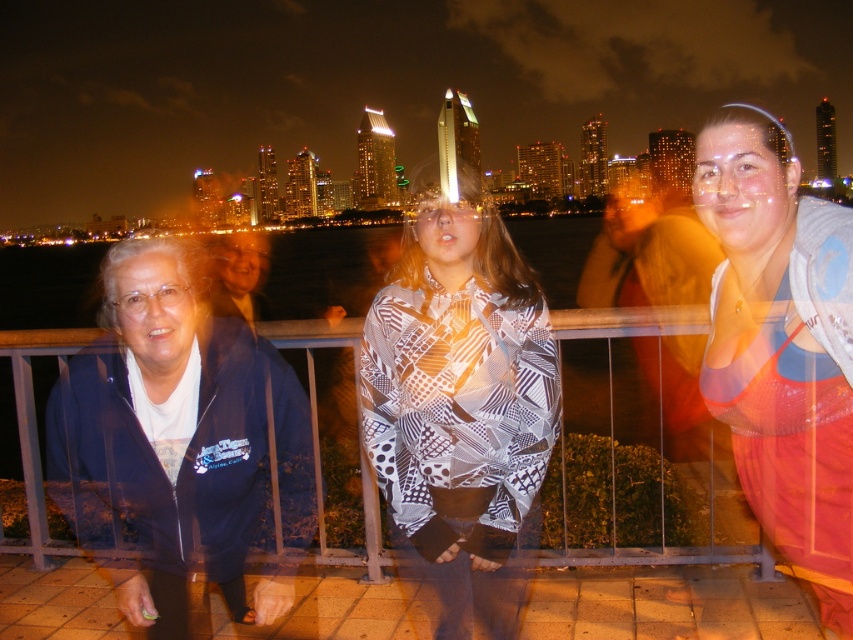
Does blue zip-up jacket at left have a lesser height compared to matte gray tank top at right?

Indeed, blue zip-up jacket at left has a lesser height compared to matte gray tank top at right.

Who is more distant from viewer, (192,340) or (833,264)?

The point (192,340) is behind.

Where is `blue zip-up jacket at left`? The height and width of the screenshot is (640, 853). blue zip-up jacket at left is located at coordinates (173, 436).

Is matte gray tank top at right above metallic silver fence at center?

Yes, matte gray tank top at right is above metallic silver fence at center.

Does matte gray tank top at right appear under metallic silver fence at center?

Actually, matte gray tank top at right is above metallic silver fence at center.

This screenshot has width=853, height=640. I want to click on matte gray tank top at right, so click(782, 349).

Where is `matte gray tank top at right`? This screenshot has width=853, height=640. matte gray tank top at right is located at coordinates (782, 349).

Does blue zip-up jacket at left have a smaller size compared to metallic silver fence at center?

Incorrect, blue zip-up jacket at left is not smaller in size than metallic silver fence at center.

Between blue zip-up jacket at left and metallic silver fence at center, which one has more height?

With more height is blue zip-up jacket at left.

Does point (140, 412) come in front of point (698, 317)?

That is False.

Locate an element on the screen. The height and width of the screenshot is (640, 853). blue zip-up jacket at left is located at coordinates (173, 436).